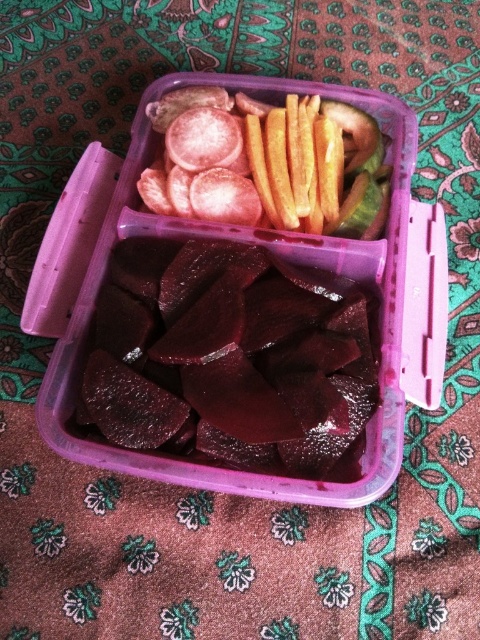
Can you confirm if dark red glossy beets at center is bigger than smooth yellow french fries at center?

Indeed, dark red glossy beets at center has a larger size compared to smooth yellow french fries at center.

Is dark red glossy beets at center taller than smooth yellow french fries at center?

Yes.

This screenshot has width=480, height=640. Find the location of `dark red glossy beets at center`. dark red glossy beets at center is located at coordinates (228, 358).